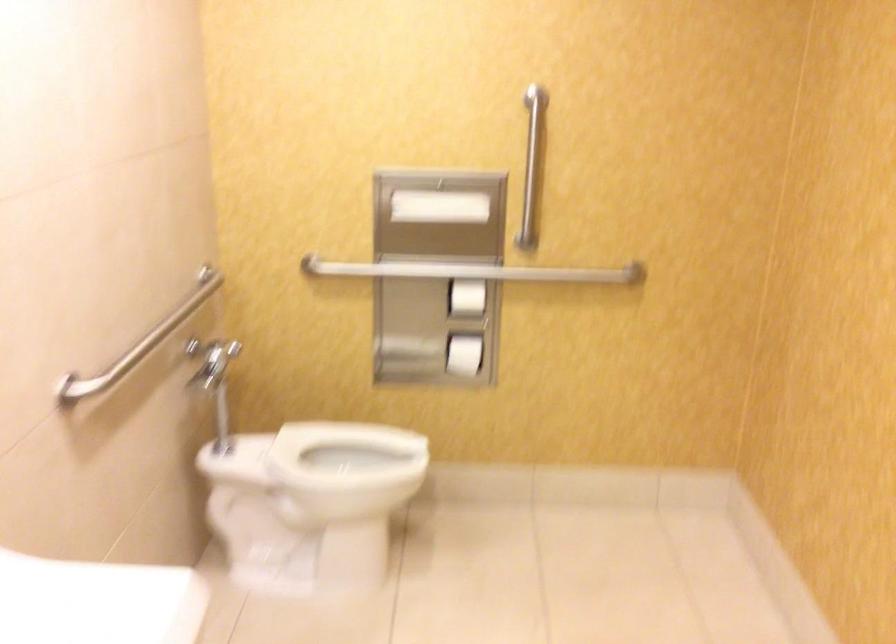
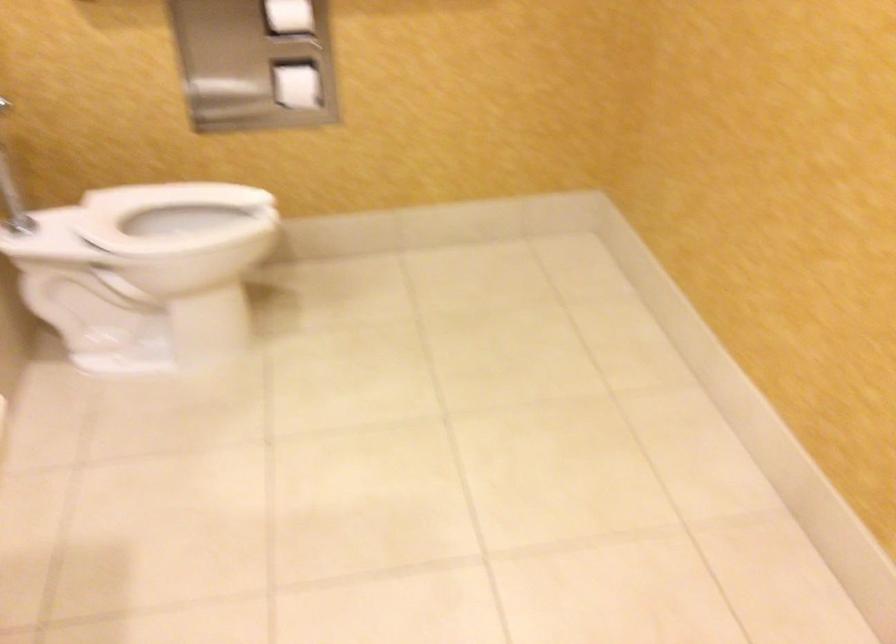
Find the pixel in the second image that matches [218,413] in the first image.

(12, 191)